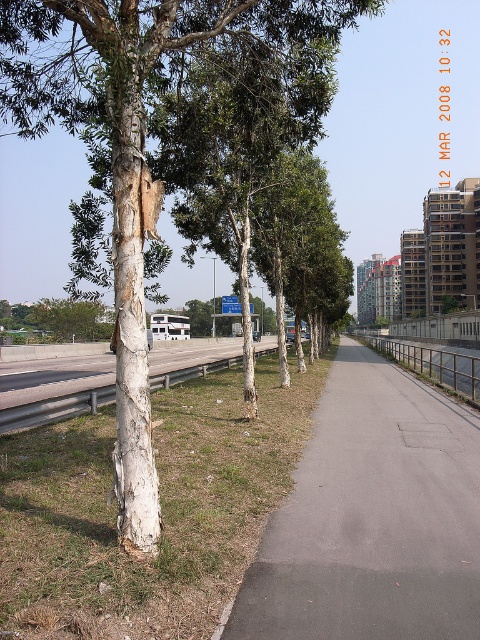
Which is more to the left, gray asphalt pavement at center or green rough bark tree at left?

green rough bark tree at left is more to the left.

Which is more to the right, gray asphalt pavement at center or green rough bark tree at left?

gray asphalt pavement at center

Find the location of a particular element. This screenshot has width=480, height=640. gray asphalt pavement at center is located at coordinates (372, 516).

Is green grass at lower left to the right of gray asphalt pavement at center from the viewer's perspective?

Incorrect, green grass at lower left is not on the right side of gray asphalt pavement at center.

Based on the photo, does green grass at lower left have a larger size compared to gray asphalt pavement at center?

Indeed, green grass at lower left has a larger size compared to gray asphalt pavement at center.

Which is behind, point (15, 595) or point (320, 500)?

The point (320, 500) is more distant.

The height and width of the screenshot is (640, 480). I want to click on green grass at lower left, so click(160, 509).

Between point (128, 435) and point (26, 321), which one is positioned in front?

Point (128, 435)

Can you confirm if white rough bark tree at left is taller than green rough bark tree at left?

No, white rough bark tree at left is not taller than green rough bark tree at left.

Between point (145, 388) and point (68, 304), which one is positioned behind?

The point (68, 304) is more distant.

Locate an element on the screen. The image size is (480, 640). white rough bark tree at left is located at coordinates (132, 150).